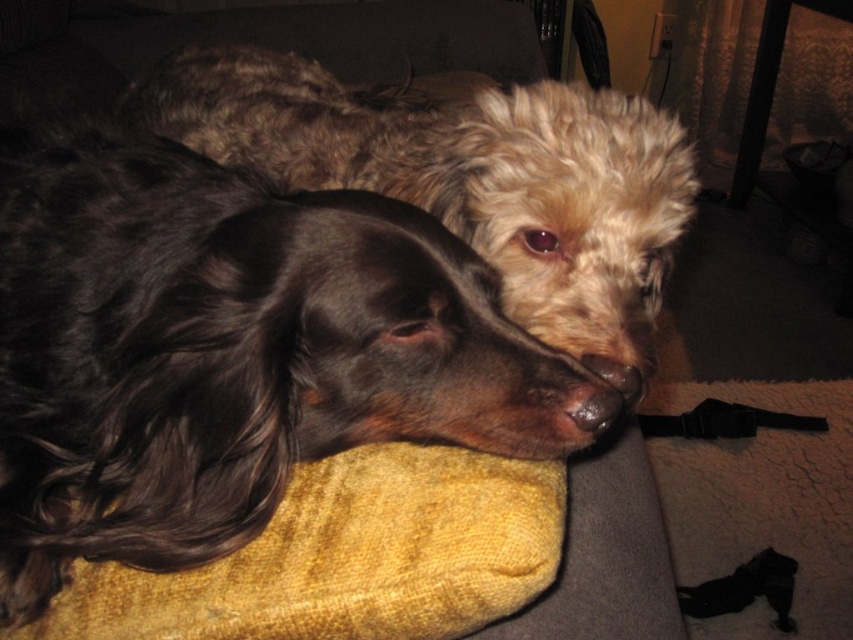
You are a photographer trying to capture a closeup of the shiny black coat at center and the black smooth nose at lower center. Which object should you focus on first if you want to ensure both are in focus?

The shiny black coat at center is taller than the black smooth nose at lower center. To ensure both are in focus, focus on the shiny black coat at center first since it is farther away and adjust the depth of field accordingly.

What are the coordinates of the black smooth nose at lower center?

The black smooth nose at lower center is located at coordinates point (x=595, y=406).

You are a photographer trying to capture the dogs from above. Which dog, the shiny black coat at center or the shiny brown fur at center, would be more visible in your top view shot?

The shiny brown fur at center would be more visible in the top view shot because it is positioned above the shiny black coat at center.